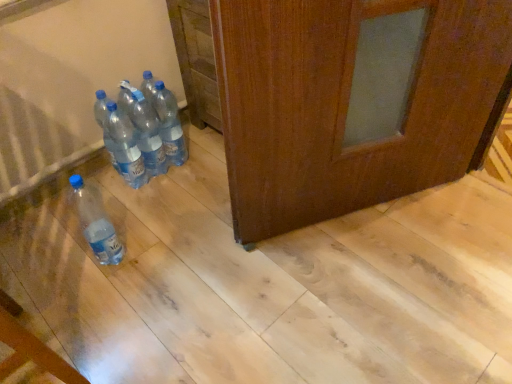
Image resolution: width=512 pixels, height=384 pixels. I want to click on free space in front of clear plastic bottles at center, which is the 3th bottle in right-to-left order, so (x=143, y=215).